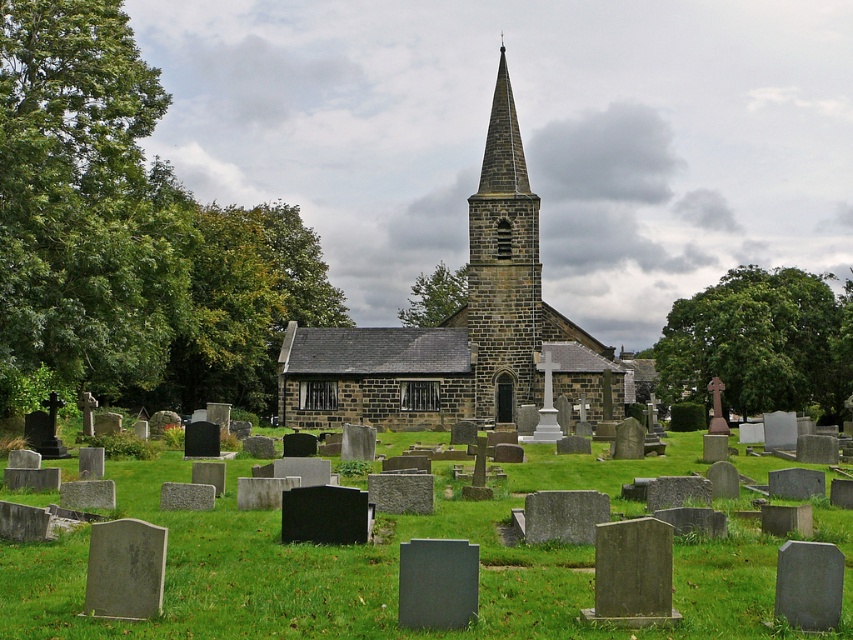
Between green leafy tree at left and brown stone church at center, which one has more height?

Standing taller between the two is brown stone church at center.

From the picture: Who is more distant from viewer, [109,88] or [595,374]?

Point [595,374]

The image size is (853, 640). What are the coordinates of `green leafy tree at left` in the screenshot? It's located at (x=128, y=234).

Does brown stone church at center have a greater height compared to brown stone steeple at center?

Yes, brown stone church at center is taller than brown stone steeple at center.

Based on the photo, does brown stone church at center appear over brown stone steeple at center?

Incorrect, brown stone church at center is not positioned above brown stone steeple at center.

In order to click on brown stone church at center in this screenshot , I will do `click(457, 326)`.

The height and width of the screenshot is (640, 853). What are the coordinates of `brown stone church at center` in the screenshot? It's located at (457, 326).

Who is positioned more to the left, brown stone church at center or green leafy tree at right?

brown stone church at center

Is point (381, 371) closer to camera compared to point (821, 406)?

Yes, it is.

Which is behind, point (488, 394) or point (734, 342)?

The point (734, 342) is more distant.

Locate an element on the screen. brown stone church at center is located at coordinates (457, 326).